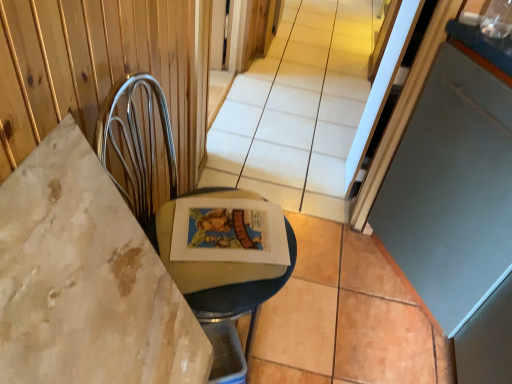
Question: From a real-world perspective, is matte gray screen door at right over metallic silver swivel chair at left?

Choices:
 (A) yes
 (B) no

Answer: (A)

Question: Considering the relative positions of matte gray screen door at right and metallic silver swivel chair at left in the image provided, is matte gray screen door at right to the left of metallic silver swivel chair at left from the viewer's perspective?

Choices:
 (A) yes
 (B) no

Answer: (B)

Question: From the image's perspective, does matte gray screen door at right appear lower than metallic silver swivel chair at left?

Choices:
 (A) yes
 (B) no

Answer: (B)

Question: From a real-world perspective, is matte gray screen door at right located beneath metallic silver swivel chair at left?

Choices:
 (A) yes
 (B) no

Answer: (B)

Question: Are matte gray screen door at right and metallic silver swivel chair at left located far from each other?

Choices:
 (A) no
 (B) yes

Answer: (A)

Question: Is matte gray screen door at right smaller than metallic silver swivel chair at left?

Choices:
 (A) yes
 (B) no

Answer: (B)

Question: Does metallic silver swivel chair at left lie behind matte gray screen door at right?

Choices:
 (A) no
 (B) yes

Answer: (A)

Question: From the image's perspective, is metallic silver swivel chair at left under matte gray screen door at right?

Choices:
 (A) no
 (B) yes

Answer: (B)

Question: From a real-world perspective, is metallic silver swivel chair at left physically above matte gray screen door at right?

Choices:
 (A) no
 (B) yes

Answer: (A)

Question: Considering the relative sizes of metallic silver swivel chair at left and matte gray screen door at right in the image provided, is metallic silver swivel chair at left taller than matte gray screen door at right?

Choices:
 (A) no
 (B) yes

Answer: (A)

Question: Can you confirm if metallic silver swivel chair at left is positioned to the right of matte gray screen door at right?

Choices:
 (A) yes
 (B) no

Answer: (B)

Question: Is metallic silver swivel chair at left looking in the opposite direction of matte gray screen door at right?

Choices:
 (A) yes
 (B) no

Answer: (B)

Question: Considering the positions of metallic silver swivel chair at left and matte gray screen door at right in the image, is metallic silver swivel chair at left taller or shorter than matte gray screen door at right?

Choices:
 (A) short
 (B) tall

Answer: (A)